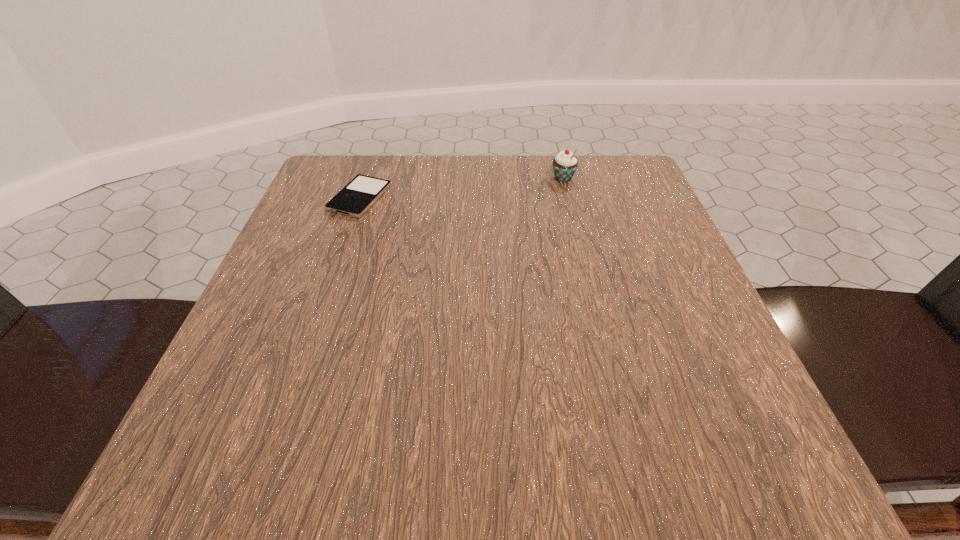
At what (x,y) coordinates should I click in order to perform the action: click on object located in the far left corner section of the desktop. Please return your answer as a coordinate pair (x, y). The image size is (960, 540). Looking at the image, I should click on (363, 191).

Where is `object that is at the far right corner`? object that is at the far right corner is located at coordinates (564, 164).

What are the coordinates of `vacant space at the far edge` in the screenshot? It's located at (x=523, y=162).

Where is `vacant space at the near edge of the desktop`? The height and width of the screenshot is (540, 960). vacant space at the near edge of the desktop is located at coordinates (422, 467).

The image size is (960, 540). In the image, there is a desktop. What are the coordinates of `vacant space at the left edge` in the screenshot? It's located at (269, 287).

In the image, there is a desktop. Where is `vacant space at the far left corner`? The image size is (960, 540). vacant space at the far left corner is located at coordinates (380, 163).

This screenshot has height=540, width=960. What are the coordinates of `vacant space at the far right corner of the desktop` in the screenshot? It's located at (641, 180).

Where is `vacant space at the near right corner of the desktop`? The width and height of the screenshot is (960, 540). vacant space at the near right corner of the desktop is located at coordinates (653, 465).

Image resolution: width=960 pixels, height=540 pixels. What are the coordinates of `free space that satisfies the following two spatial constraints: 1. on the back side of the right object; 2. on the left side of the shorter object` in the screenshot? It's located at (367, 178).